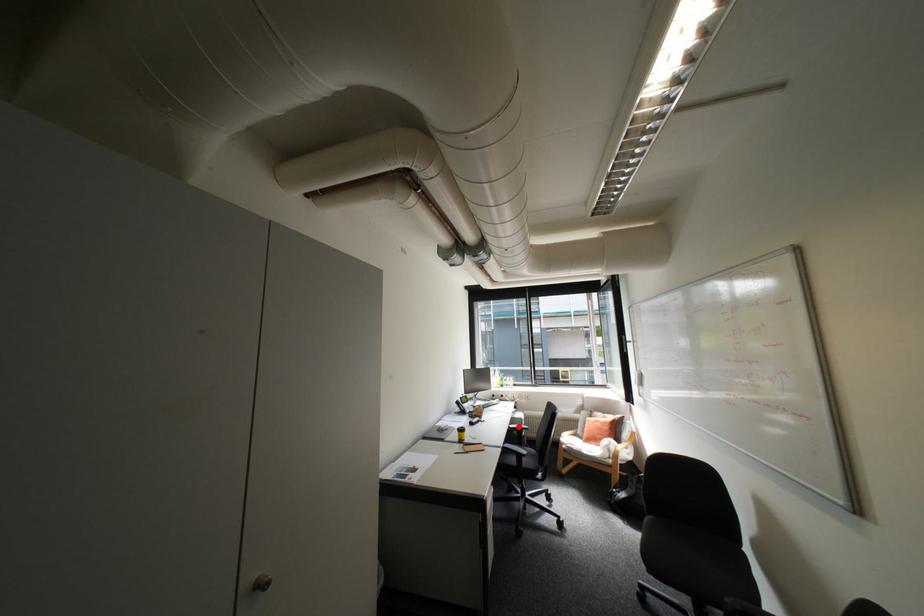
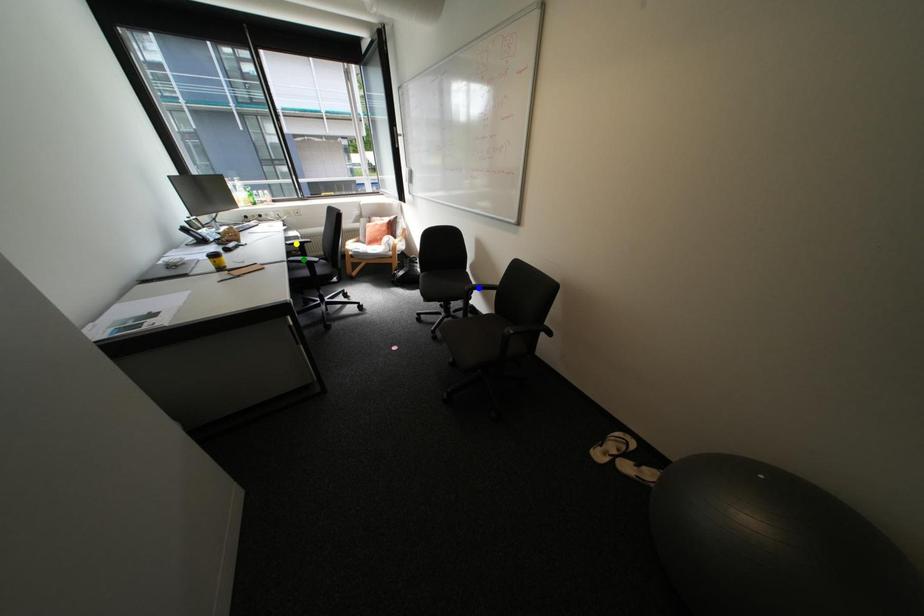
Question: I am providing you with two images of the same scene from different viewpoints. A red point is marked on the first image. You are given multiple points on the second image. Which mark in image 2 goes with the point in image 1?

Choices:
 (A) yellow point
 (B) blue point
 (C) green point

Answer: (A)